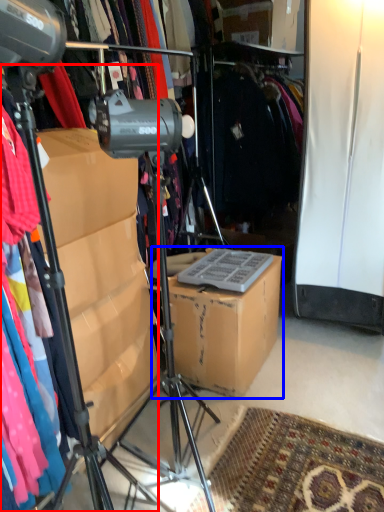
Question: Which of the following is the closest to the observer, tripod (highlighted by a red box) or cardboard box (highlighted by a blue box)?

Choices:
 (A) tripod
 (B) cardboard box

Answer: (A)